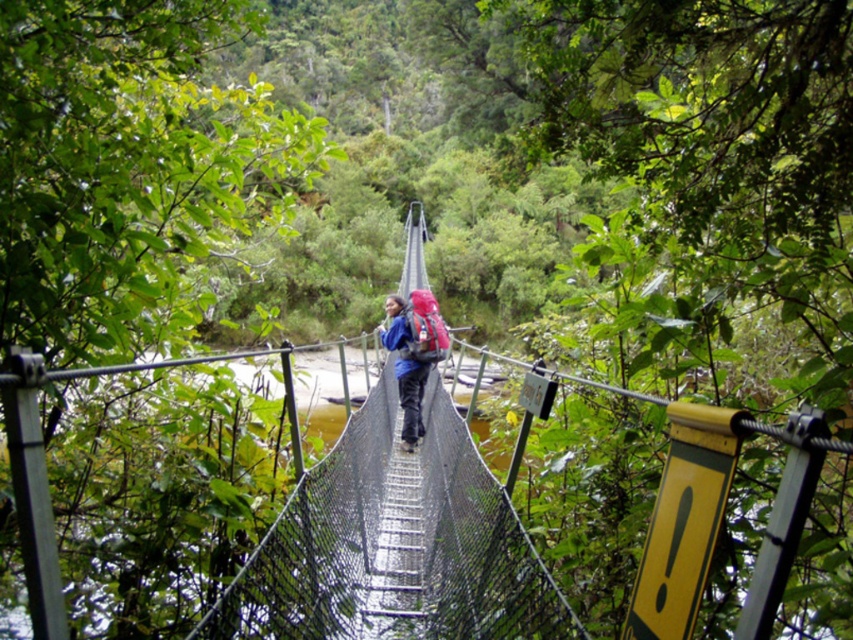
Question: Considering the relative positions of metal mesh bridge at center and blue fabric backpack at center in the image provided, where is metal mesh bridge at center located with respect to blue fabric backpack at center?

Choices:
 (A) left
 (B) right

Answer: (A)

Question: Which point appears farthest from the camera in this image?

Choices:
 (A) (412, 330)
 (B) (456, 624)

Answer: (A)

Question: Does metal mesh bridge at center appear on the left side of blue fabric backpack at center?

Choices:
 (A) no
 (B) yes

Answer: (B)

Question: Does metal mesh bridge at center appear over blue fabric backpack at center?

Choices:
 (A) yes
 (B) no

Answer: (A)

Question: Which point is closer to the camera?

Choices:
 (A) metal mesh bridge at center
 (B) blue fabric backpack at center

Answer: (A)